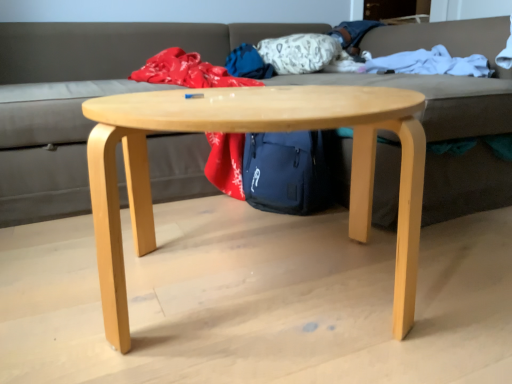
Question: From a real-world perspective, is gray fabric couch at center physically located above or below white soft blanket at upper right?

Choices:
 (A) above
 (B) below

Answer: (B)

Question: Is gray fabric couch at center wider or thinner than white soft blanket at upper right?

Choices:
 (A) wide
 (B) thin

Answer: (A)

Question: Considering the real-world distances, which object is farthest from the white soft blanket at upper right?

Choices:
 (A) natural wood coffee table at center
 (B) gray fabric couch at center

Answer: (B)

Question: Estimate the real-world distances between objects in this image. Which object is closer to the natural wood coffee table at center?

Choices:
 (A) gray fabric couch at center
 (B) white soft blanket at upper right

Answer: (B)